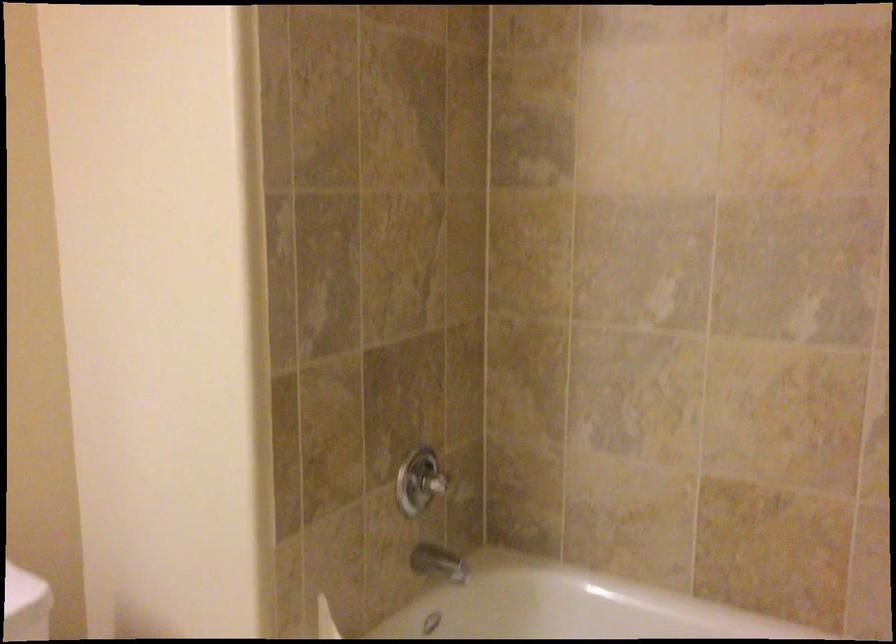
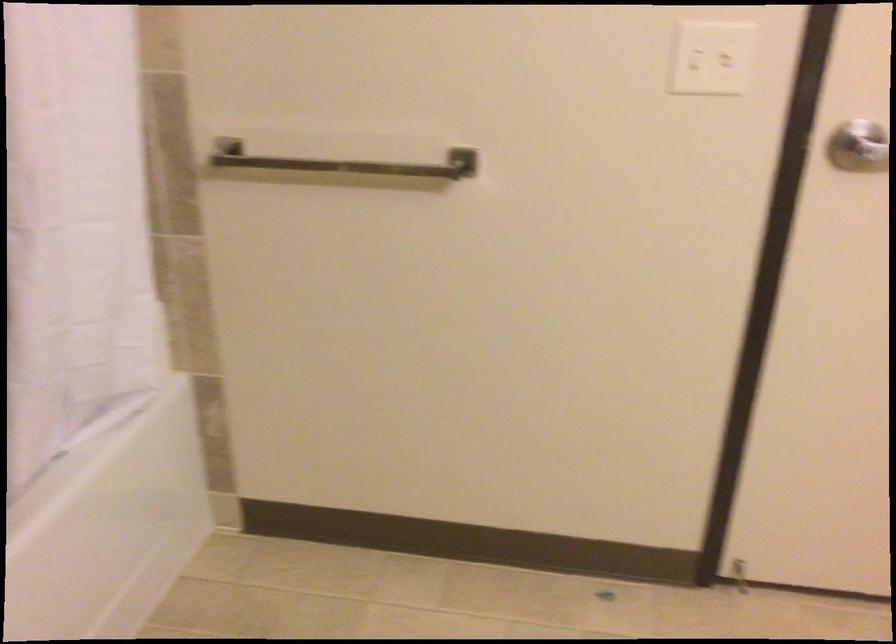
The first image is from the beginning of the video and the second image is from the end. How did the camera likely rotate when shooting the video?

The camera's rotation is toward right-down.